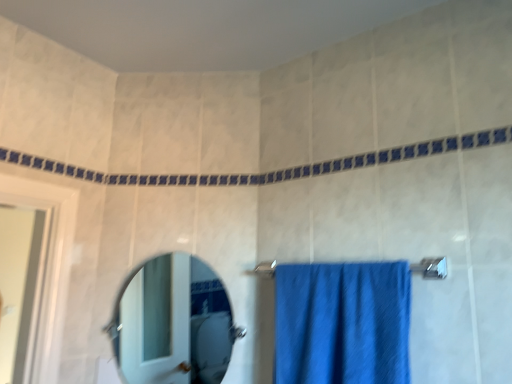
Where is `blue fabric towel bar at center`? The height and width of the screenshot is (384, 512). blue fabric towel bar at center is located at coordinates (431, 268).

Locate an element on the screen. The height and width of the screenshot is (384, 512). polished silver mirror at center is located at coordinates (174, 323).

Where is `blue fabric towel at center`? The width and height of the screenshot is (512, 384). blue fabric towel at center is located at coordinates (342, 323).

From a real-world perspective, which is physically below, blue fabric towel bar at center or polished silver mirror at center?

polished silver mirror at center is physically lower.

From the image's perspective, is blue fabric towel bar at center below polished silver mirror at center?

No.

From the picture: Is blue fabric towel bar at center not close to polished silver mirror at center?

Yes, blue fabric towel bar at center is far from polished silver mirror at center.

In terms of height, does blue fabric towel at center look taller or shorter compared to polished silver mirror at center?

Considering their sizes, blue fabric towel at center has less height than polished silver mirror at center.

Which is behind, point (275, 308) or point (168, 347)?

The point (168, 347) is farther.

Is blue fabric towel at center touching polished silver mirror at center?

No.

From the picture: Is blue fabric towel at center not inside polished silver mirror at center?

Yes, blue fabric towel at center is outside of polished silver mirror at center.

From a real-world perspective, which is physically above, blue fabric towel bar at center or blue fabric towel at center?

In real-world perspective, blue fabric towel bar at center is above.

Where is `towel bar on the right of blue fabric towel at center`? towel bar on the right of blue fabric towel at center is located at coordinates (431, 268).

From the image's perspective, who appears lower, blue fabric towel bar at center or blue fabric towel at center?

blue fabric towel at center appears lower in the image.

Are blue fabric towel bar at center and blue fabric towel at center far apart?

blue fabric towel bar at center is near blue fabric towel at center, not far away.

In the image, there is a blue fabric towel bar at center. Where is `mirror below it (from the image's perspective)`? This screenshot has height=384, width=512. mirror below it (from the image's perspective) is located at coordinates (174, 323).

From a real-world perspective, is polished silver mirror at center located higher than blue fabric towel bar at center?

Actually, polished silver mirror at center is physically below blue fabric towel bar at center in the real world.

Visually, is polished silver mirror at center positioned to the left or to the right of blue fabric towel bar at center?

polished silver mirror at center is to the left of blue fabric towel bar at center.

Is blue fabric towel at center wider than blue fabric towel bar at center?

Correct, the width of blue fabric towel at center exceeds that of blue fabric towel bar at center.

Find the location of a particular element. towel located on the left of blue fabric towel bar at center is located at coordinates (342, 323).

Looking at this image, from a real-world perspective, is blue fabric towel at center physically located above or below blue fabric towel bar at center?

Clearly, from a real-world perspective, blue fabric towel at center is below blue fabric towel bar at center.

From the image's perspective, which one is positioned higher, blue fabric towel at center or blue fabric towel bar at center?

blue fabric towel bar at center is shown above in the image.

Identify the location of towel located underneath the polished silver mirror at center (from a real-world perspective). Image resolution: width=512 pixels, height=384 pixels. (342, 323).

Can you confirm if polished silver mirror at center is shorter than blue fabric towel at center?

No.

From the image's perspective, which object appears higher, polished silver mirror at center or blue fabric towel at center?

From the image's view, blue fabric towel at center is above.

Identify the location of mirror behind the blue fabric towel bar at center. (174, 323).

You are a GUI agent. You are given a task and a screenshot of the screen. Output one action in this format:
    pyautogui.click(x=<x>, y=<y>)
    Task: Click on the towel located above the polished silver mirror at center (from the image's perspective)
    This screenshot has height=384, width=512.
    Given the screenshot: What is the action you would take?
    pyautogui.click(x=342, y=323)

Estimate the real-world distances between objects in this image. Which object is further from blue fabric towel bar at center, polished silver mirror at center or blue fabric towel at center?

Among the two, polished silver mirror at center is located further to blue fabric towel bar at center.

Looking at the image, which one is located further to blue fabric towel bar at center, blue fabric towel at center or polished silver mirror at center?

polished silver mirror at center is further to blue fabric towel bar at center.

Considering their positions, is blue fabric towel bar at center positioned further to blue fabric towel at center than polished silver mirror at center?

polished silver mirror at center.

From the image, which object appears to be farther from polished silver mirror at center, blue fabric towel bar at center or blue fabric towel at center?

blue fabric towel bar at center.

Based on their spatial positions, is polished silver mirror at center or blue fabric towel bar at center closer to blue fabric towel at center?

blue fabric towel bar at center lies closer to blue fabric towel at center than the other object.

Estimate the real-world distances between objects in this image. Which object is further from polished silver mirror at center, blue fabric towel at center or blue fabric towel bar at center?

blue fabric towel bar at center is further to polished silver mirror at center.

You are a GUI agent. You are given a task and a screenshot of the screen. Output one action in this format:
    pyautogui.click(x=<x>, y=<y>)
    Task: Click on the towel between polished silver mirror at center and blue fabric towel bar at center in the horizontal direction
    
    Given the screenshot: What is the action you would take?
    pyautogui.click(x=342, y=323)